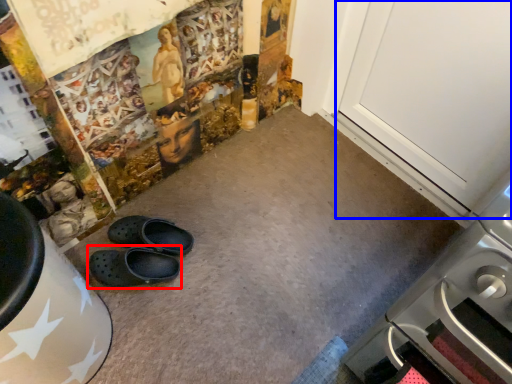
Question: Which object appears closest to the camera in this image, footwear (highlighted by a red box) or door (highlighted by a blue box)?

Choices:
 (A) footwear
 (B) door

Answer: (B)